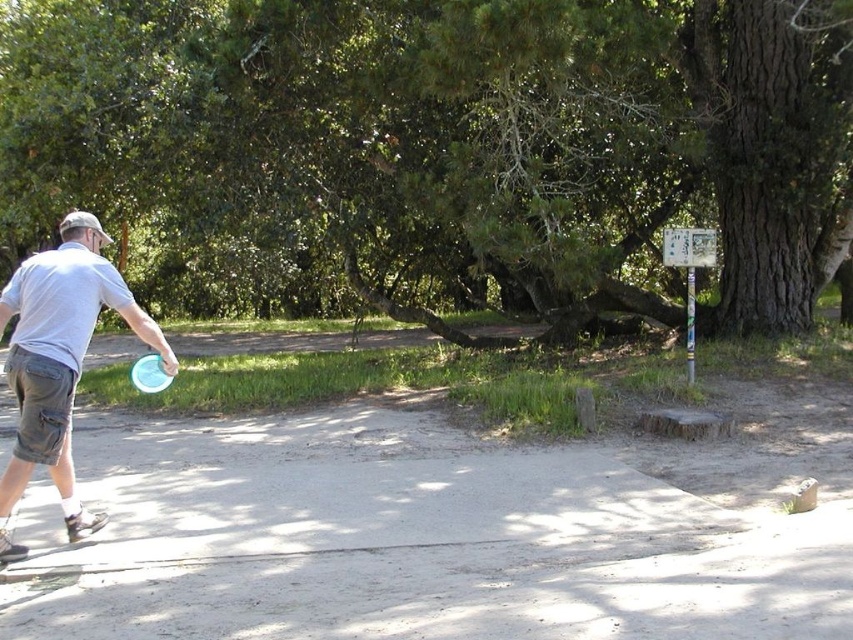
Question: Which point is closer to the camera taking this photo?

Choices:
 (A) (20, 488)
 (B) (717, 24)

Answer: (A)

Question: Is green leafy tree at upper center bigger than blue plastic frisbee at left?

Choices:
 (A) yes
 (B) no

Answer: (A)

Question: Which point appears closest to the camera in this image?

Choices:
 (A) (520, 310)
 (B) (170, 376)
 (C) (32, 378)

Answer: (C)

Question: Can you confirm if green leafy tree at upper center is positioned above white matte frisbee at left?

Choices:
 (A) no
 (B) yes

Answer: (B)

Question: Considering the real-world distances, which object is closest to the green leafy tree at upper center?

Choices:
 (A) blue plastic frisbee at left
 (B) white matte frisbee at left

Answer: (A)

Question: Is white matte frisbee at left to the left of blue plastic frisbee at left from the viewer's perspective?

Choices:
 (A) no
 (B) yes

Answer: (B)